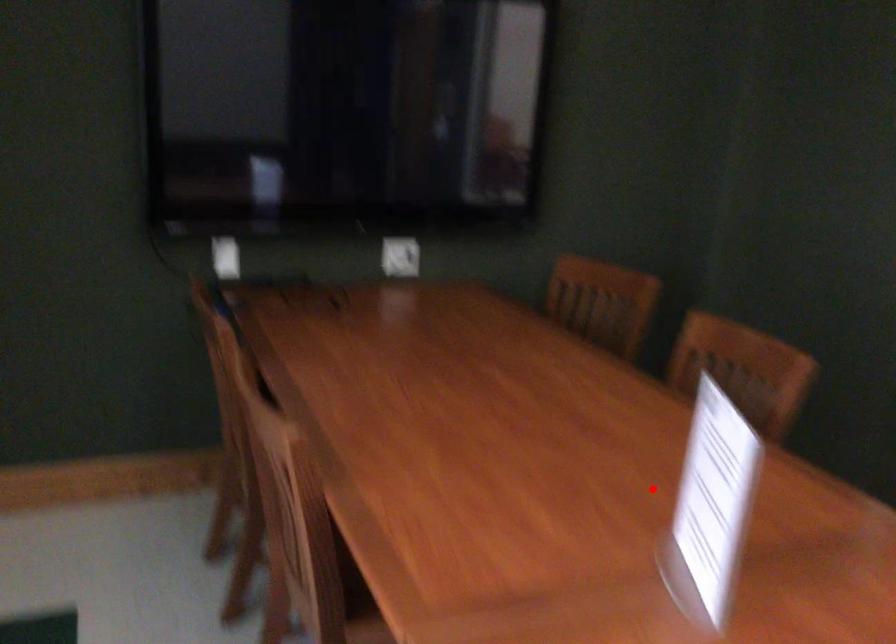
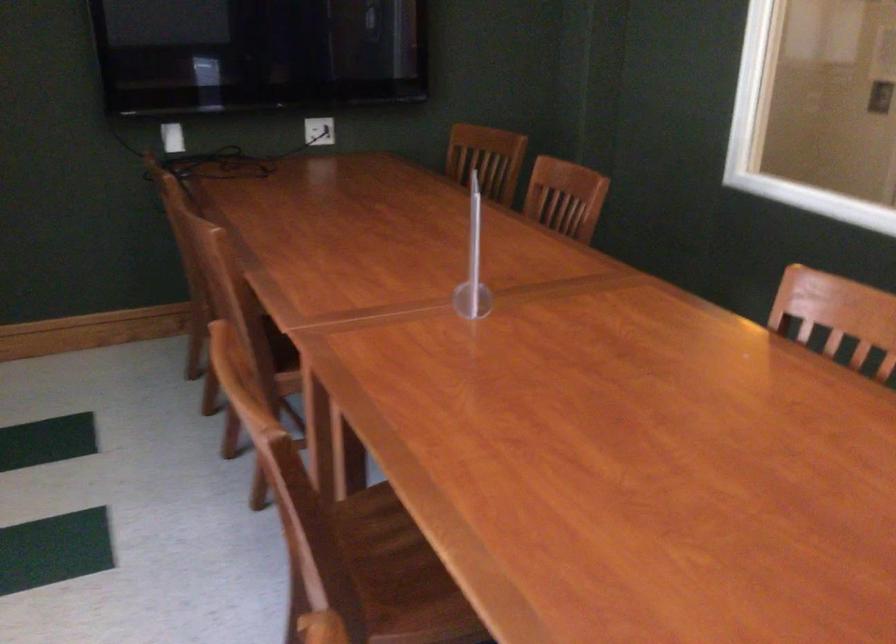
Find the pixel in the second image that matches the highlighted location in the first image.

(472, 263)